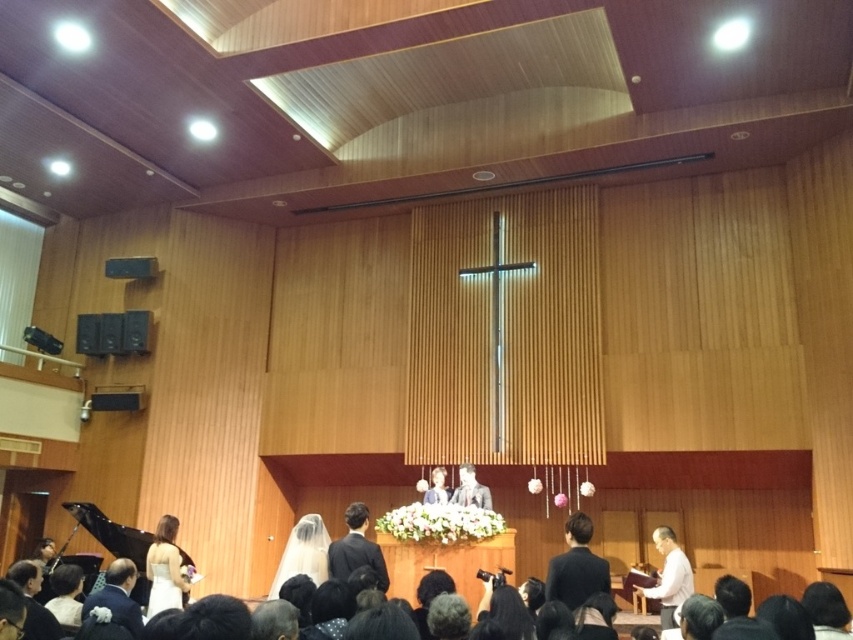
You are a photographer at a wedding and need to capture a closeup of the white satin veil at lower left and the light beige fabric dress at center. Which object should you zoom in on to ensure both are in frame without moving the camera?

The white satin veil at lower left might be wider than the light beige fabric dress at center, so you should zoom in on the veil to ensure both are in frame without moving the camera.

You are a photographer standing at the back of the church during a wedding. You want to capture a closeup shot of the white satin veil at lower left. Considering your current position, can you estimate if you can get a clear closeup without moving closer than 5 meters?

The white satin veil at lower left is 5.06 meters away from camera. Since you are standing at least 5 meters away, you are just slightly too far to capture a clear closeup without moving closer.

You are a photographer at the wedding ceremony. You need to capture a photo of the light beige fabric dress at center and the white satin veil at lower left. Which object is positioned lower in the frame?

The white satin veil at lower left is positioned below the light beige fabric dress at center, so it is lower in the frame.